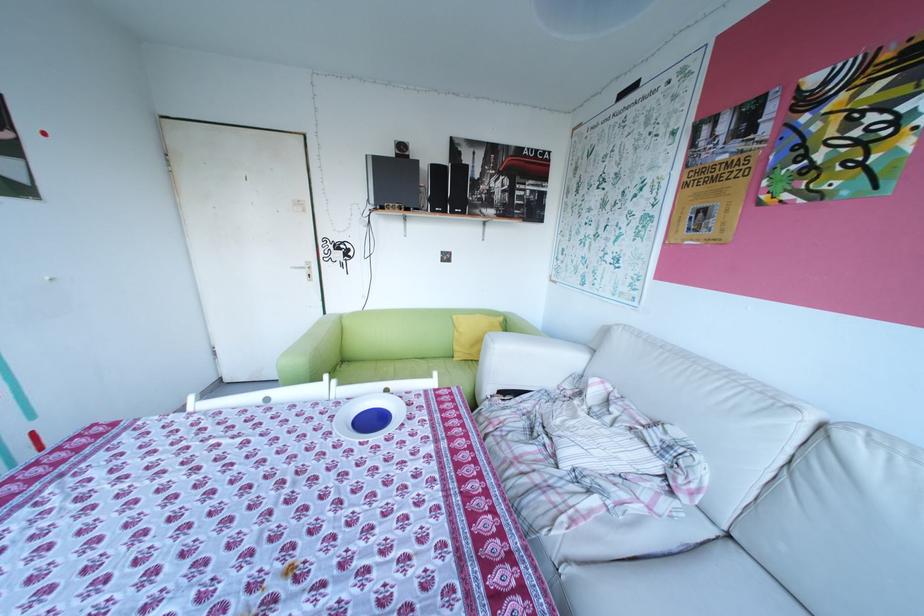
What do you see at coordinates (307, 269) in the screenshot? I see `the silver door handle` at bounding box center [307, 269].